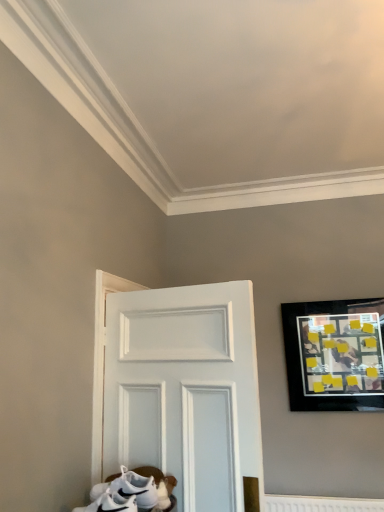
Question: From the image's perspective, is white matte sneakers at lower left above or below black matte picture frame at upper right?

Choices:
 (A) above
 (B) below

Answer: (B)

Question: Considering the positions of point (162, 486) and point (304, 373), is point (162, 486) closer or farther from the camera than point (304, 373)?

Choices:
 (A) farther
 (B) closer

Answer: (B)

Question: Looking at the image, does white matte sneakers at lower left seem bigger or smaller compared to black matte picture frame at upper right?

Choices:
 (A) small
 (B) big

Answer: (A)

Question: Considering their positions, is black matte picture frame at upper right located in front of or behind white matte sneakers at lower left?

Choices:
 (A) front
 (B) behind

Answer: (B)

Question: From the image's perspective, is black matte picture frame at upper right above or below white matte sneakers at lower left?

Choices:
 (A) above
 (B) below

Answer: (A)

Question: Is black matte picture frame at upper right taller or shorter than white matte sneakers at lower left?

Choices:
 (A) tall
 (B) short

Answer: (A)

Question: From a real-world perspective, relative to white matte sneakers at lower left, is black matte picture frame at upper right vertically above or below?

Choices:
 (A) above
 (B) below

Answer: (A)